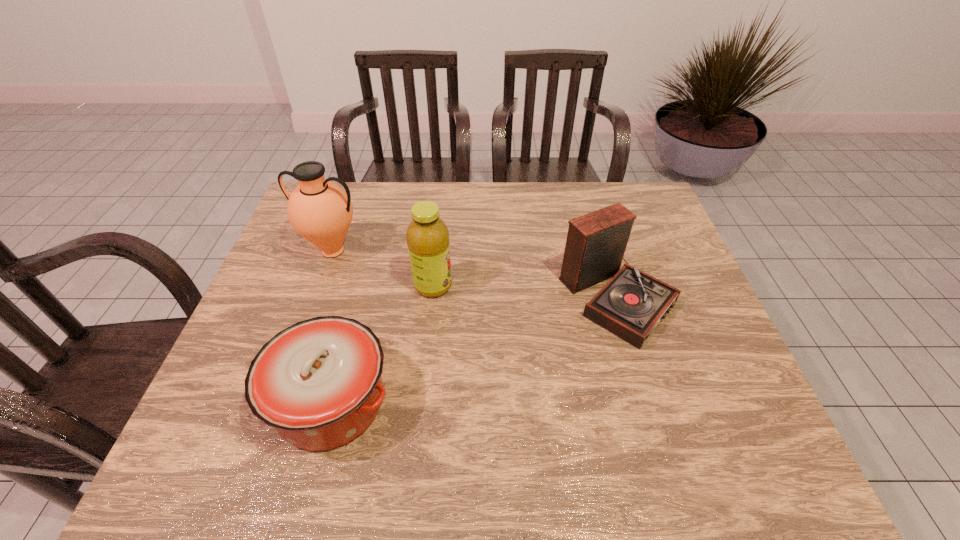
The height and width of the screenshot is (540, 960). Identify the location of pitcher. (319, 210).

The width and height of the screenshot is (960, 540). In order to click on fruit juice in this screenshot , I will do `click(427, 236)`.

Find the location of `the rightmost object`. the rightmost object is located at coordinates (632, 303).

The image size is (960, 540). In order to click on the second shortest object in this screenshot , I will do `click(632, 303)`.

You are a GUI agent. You are given a task and a screenshot of the screen. Output one action in this format:
    pyautogui.click(x=<x>, y=<y>)
    Task: Click on the nearest object
    The width and height of the screenshot is (960, 540).
    Given the screenshot: What is the action you would take?
    pyautogui.click(x=318, y=382)

In order to click on the shortest object in this screenshot , I will do `click(318, 382)`.

Identify the location of vacant space situated on the front of the pitcher. The height and width of the screenshot is (540, 960). (283, 390).

Where is `vacant point located on the front label of the second object from right to left`? vacant point located on the front label of the second object from right to left is located at coordinates (486, 286).

Locate an element on the screen. Image resolution: width=960 pixels, height=540 pixels. free region located 0.320m on the back of the rightmost object is located at coordinates (587, 192).

At what (x,y) coordinates should I click in order to perform the action: click on vacant region located 0.250m on the back of the casserole. Please return your answer as a coordinate pair (x, y). Looking at the image, I should click on (364, 277).